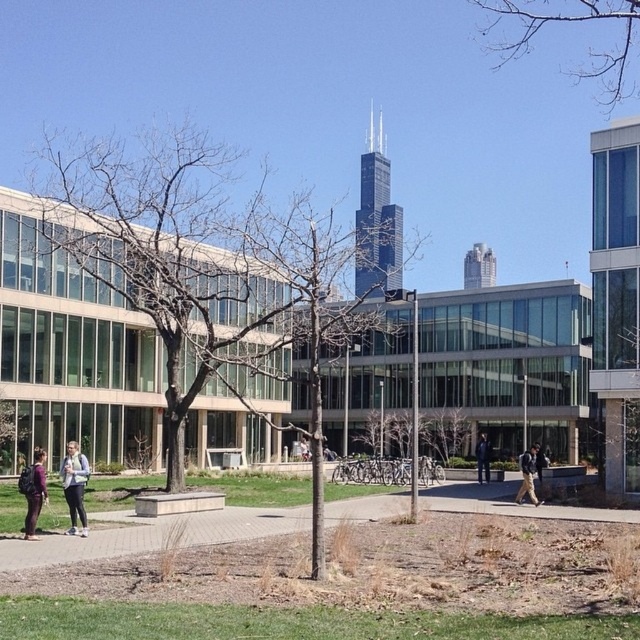
Question: Which point is farther to the camera?

Choices:
 (A) dark blue suit at center
 (B) paved concrete sidewalk at lower center

Answer: (A)

Question: Which object is farther from the camera taking this photo?

Choices:
 (A) matte white jacket at center
 (B) dark blue suit at center
 (C) matte purple jacket at lower left

Answer: (B)

Question: Considering the real-world distances, which object is closest to the matte purple jacket at lower left?

Choices:
 (A) matte white jacket at center
 (B) khaki pants at center
 (C) paved concrete sidewalk at lower center

Answer: (A)

Question: Considering the relative positions of khaki pants at center and dark blue suit at center in the image provided, where is khaki pants at center located with respect to dark blue suit at center?

Choices:
 (A) below
 (B) above

Answer: (B)

Question: Is the position of matte white jacket at center less distant than that of khaki pants at center?

Choices:
 (A) yes
 (B) no

Answer: (A)

Question: Is paved concrete sidewalk at lower center in front of khaki pants at center?

Choices:
 (A) no
 (B) yes

Answer: (B)